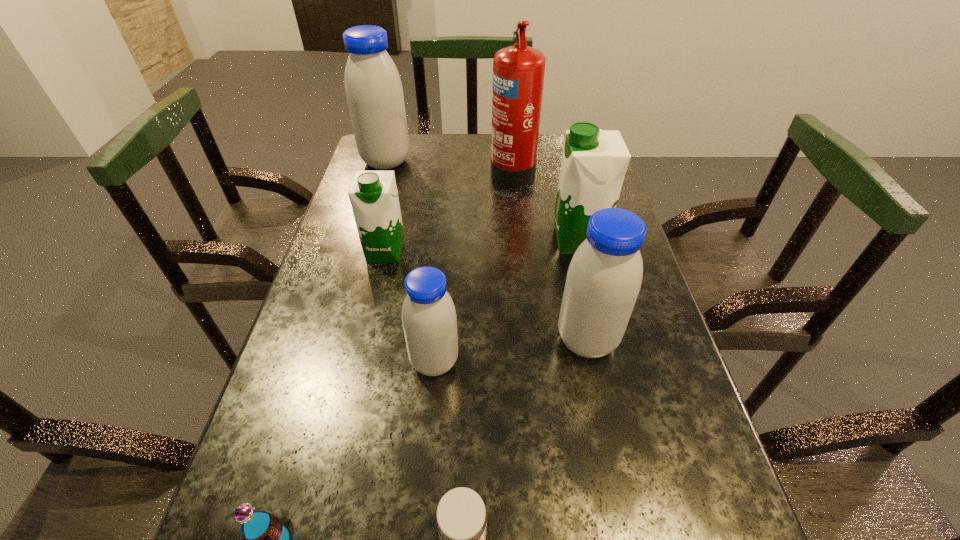
Find the location of a particular element. Image resolution: width=960 pixels, height=540 pixels. free space located 0.130m on the surface of the red fire extinguisher is located at coordinates (447, 170).

Find the location of `free spot located 0.350m on the front of the tallest soya milk`. free spot located 0.350m on the front of the tallest soya milk is located at coordinates (359, 253).

Locate an element on the screen. The image size is (960, 540). free space located 0.340m on the front-facing side of the right green soya milk is located at coordinates (416, 241).

Locate an element on the screen. This screenshot has height=540, width=960. vacant space located on the front-facing side of the right green soya milk is located at coordinates (464, 241).

Image resolution: width=960 pixels, height=540 pixels. What are the coordinates of `free space located on the front-facing side of the right green soya milk` in the screenshot? It's located at point(416,241).

Locate an element on the screen. The height and width of the screenshot is (540, 960). free space located on the back of the rightmost blue soya milk is located at coordinates (564, 230).

At what (x,y) coordinates should I click in order to perform the action: click on vacant region located on the front-facing side of the left green soya milk. Please return your answer as a coordinate pair (x, y). Image resolution: width=960 pixels, height=540 pixels. Looking at the image, I should click on (362, 354).

Image resolution: width=960 pixels, height=540 pixels. In order to click on vacant space located on the right of the smallest blue soya milk in this screenshot , I will do `click(661, 362)`.

This screenshot has height=540, width=960. I want to click on fire extinguisher that is at the far edge, so click(518, 71).

Where is `soya milk positioned at the far edge`? This screenshot has width=960, height=540. soya milk positioned at the far edge is located at coordinates pos(373,87).